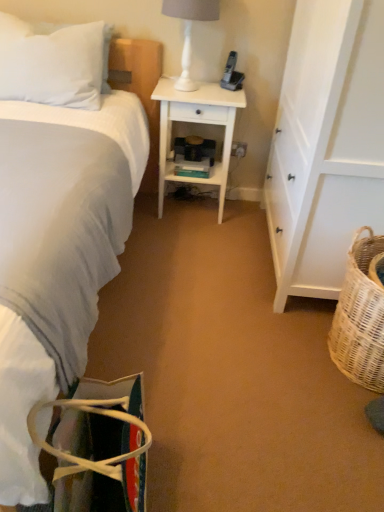
This screenshot has height=512, width=384. Find the location of `vacant space to the left of woven wicker basket at lower right`. vacant space to the left of woven wicker basket at lower right is located at coordinates (270, 353).